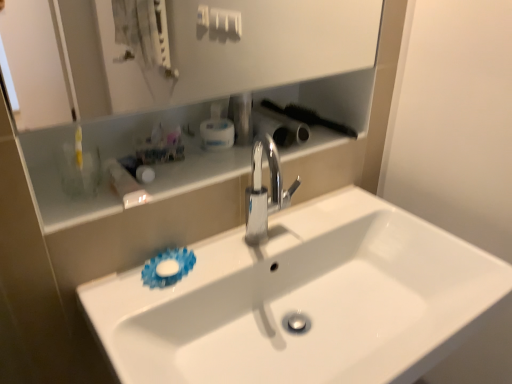
The height and width of the screenshot is (384, 512). Find the location of `vacant space to the right of polished chrome faucet at center`. vacant space to the right of polished chrome faucet at center is located at coordinates pyautogui.click(x=326, y=223).